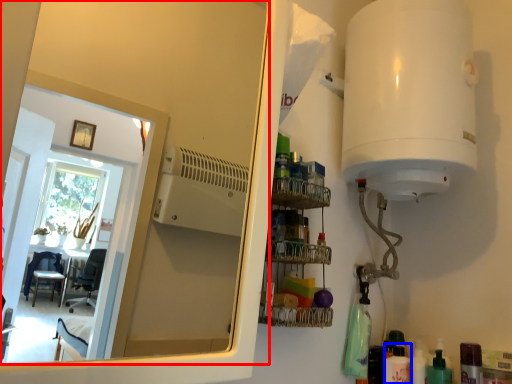
Question: Which object appears farthest to the camera in this image, mirror (highlighted by a red box) or toiletry (highlighted by a blue box)?

Choices:
 (A) mirror
 (B) toiletry

Answer: (B)